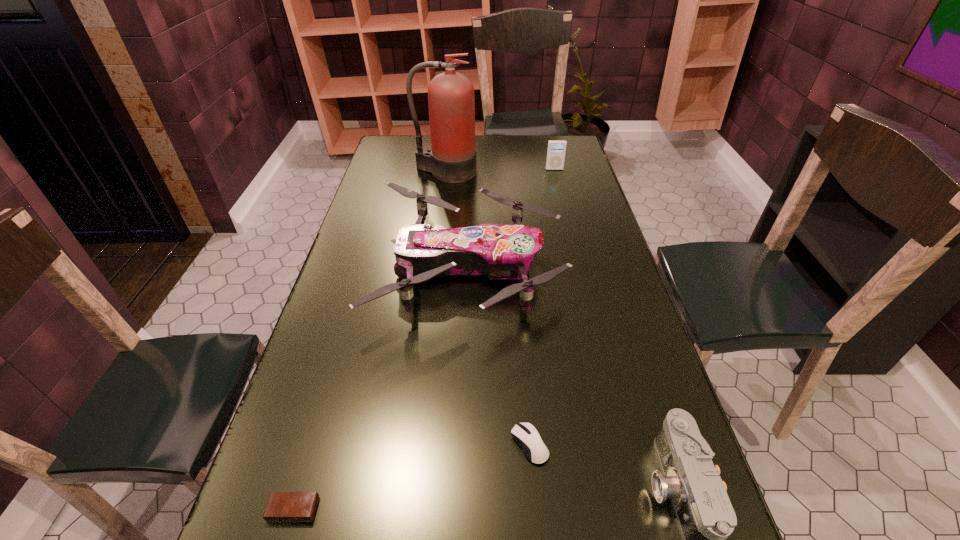
I want to click on fire extinguisher that is at the left edge, so click(451, 100).

Where is `drone that is at the left edge`? The image size is (960, 540). drone that is at the left edge is located at coordinates (499, 251).

This screenshot has width=960, height=540. Find the location of `alarm clock that is at the left edge`. alarm clock that is at the left edge is located at coordinates (282, 506).

You are a GUI agent. You are given a task and a screenshot of the screen. Output one action in this format:
    pyautogui.click(x=<x>, y=<y>)
    Task: Click on the object present at the right edge
    Image resolution: width=960 pixels, height=540 pixels.
    Given the screenshot: What is the action you would take?
    pyautogui.click(x=556, y=150)

You are a GUI agent. You are given a task and a screenshot of the screen. Output one action in this format:
    pyautogui.click(x=<x>, y=<y>)
    Task: Click on the object present at the far left corner
    
    Given the screenshot: What is the action you would take?
    pyautogui.click(x=451, y=100)

Where is `free space at the far edge of the desktop`? free space at the far edge of the desktop is located at coordinates (502, 140).

Where is `vacant space at the left edge`? The image size is (960, 540). vacant space at the left edge is located at coordinates (353, 420).

In the image, there is a desktop. Find the location of `free space at the right edge`. free space at the right edge is located at coordinates (627, 380).

This screenshot has width=960, height=540. I want to click on vacant space at the far left corner, so click(408, 157).

Identify the location of vacant space at the far right corner. (546, 152).